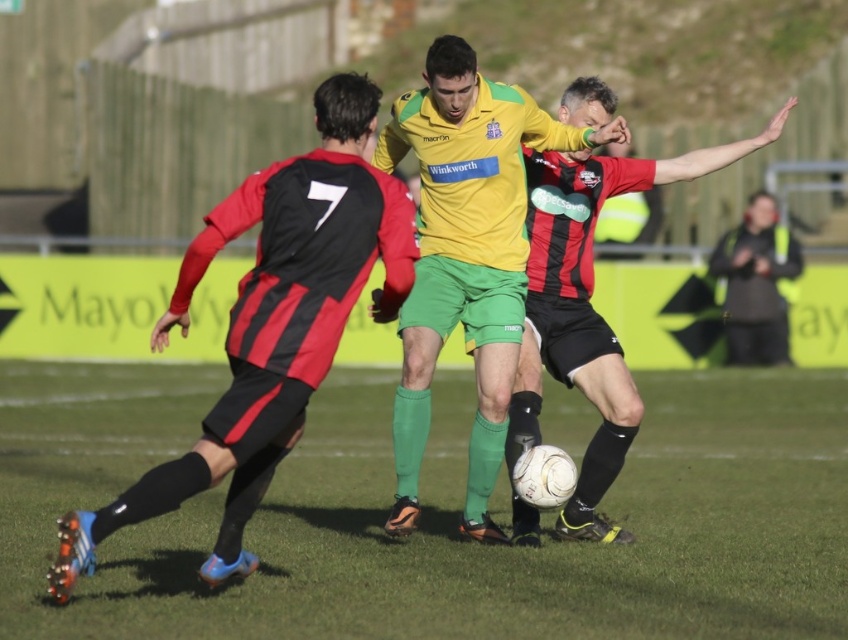
Question: Which of the following is the closest to the observer?

Choices:
 (A) black matte jacket at right
 (B) green grass at center
 (C) matte black jersey at left

Answer: (C)

Question: Which object appears farthest from the camera in this image?

Choices:
 (A) green grass at center
 (B) black matte jacket at right
 (C) yellow jersey at center
 (D) matte black jersey at left

Answer: (B)

Question: Is matte black jersey at left smaller than matte black shorts at center?

Choices:
 (A) no
 (B) yes

Answer: (A)

Question: Which object appears farthest from the camera in this image?

Choices:
 (A) matte black shorts at center
 (B) black matte jacket at right
 (C) green grass at center

Answer: (B)

Question: Is green grass at center positioned before yellow jersey at center?

Choices:
 (A) no
 (B) yes

Answer: (B)

Question: Is the position of matte black jersey at left more distant than that of yellow jersey at center?

Choices:
 (A) yes
 (B) no

Answer: (B)